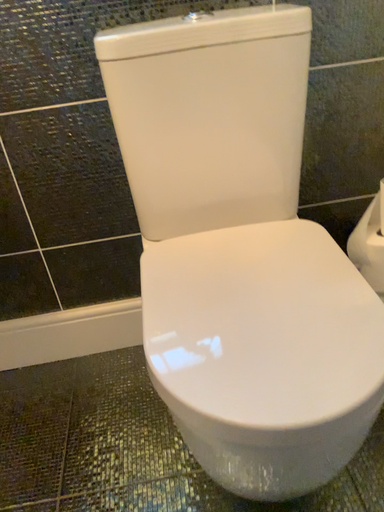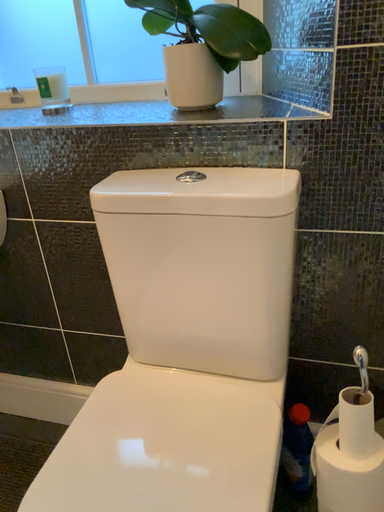
Question: Which way did the camera rotate in the video?

Choices:
 (A) rotated downward
 (B) rotated upward

Answer: (B)